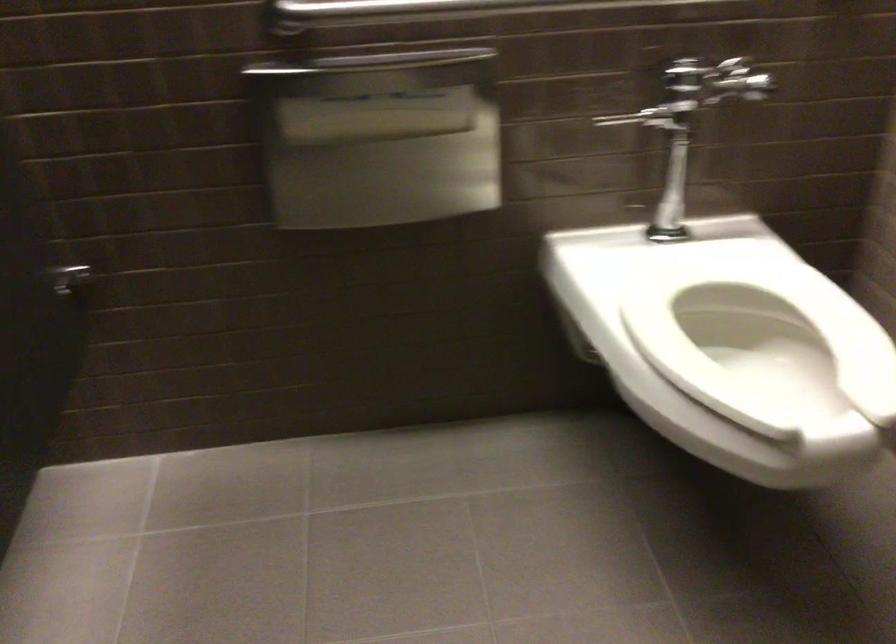
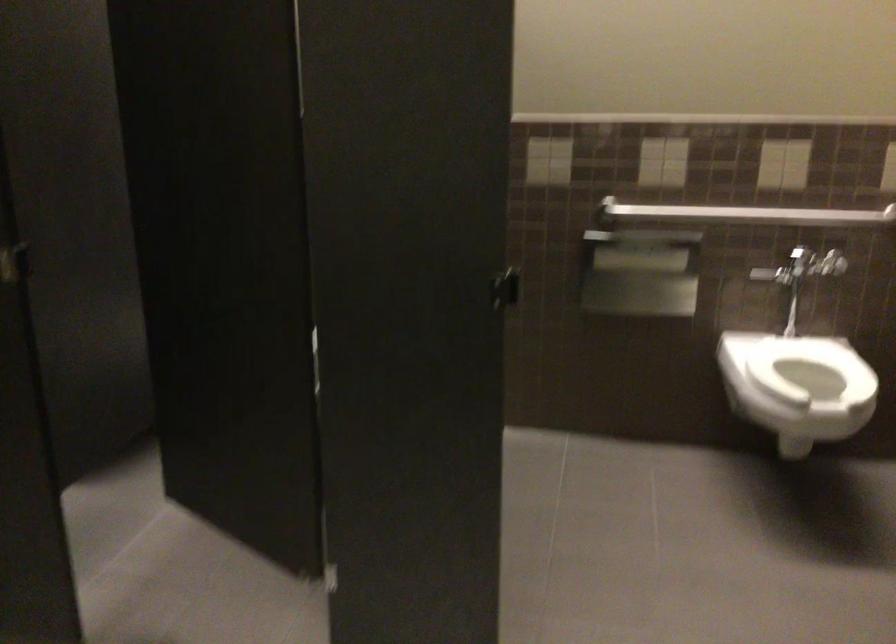
Where in the second image is the point corresponding to the point at 707,313 from the first image?

(810, 368)